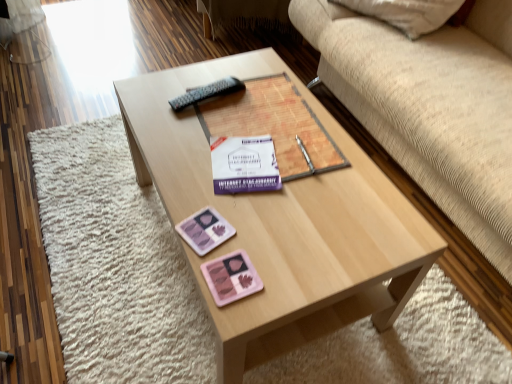
Question: From the image's perspective, would you say pink matte eyeshadow palette at lower center, which is the second currency from top to bottom, is shown under beige fabric couch at upper right?

Choices:
 (A) yes
 (B) no

Answer: (A)

Question: Can you confirm if pink matte eyeshadow palette at lower center, which is the second currency from top to bottom, is positioned to the right of beige fabric couch at upper right?

Choices:
 (A) yes
 (B) no

Answer: (B)

Question: Does pink matte eyeshadow palette at lower center, which is the second currency from top to bottom, have a lesser width compared to beige fabric couch at upper right?

Choices:
 (A) yes
 (B) no

Answer: (A)

Question: Is pink matte eyeshadow palette at lower center, which is the 1th currency from bottom to top, wider than beige fabric couch at upper right?

Choices:
 (A) yes
 (B) no

Answer: (B)

Question: Considering the relative positions of purple matte book at center and white paper at center in the image provided, is purple matte book at center to the left or to the right of white paper at center?

Choices:
 (A) right
 (B) left

Answer: (A)

Question: From the image's perspective, is purple matte book at center located above or below white paper at center?

Choices:
 (A) below
 (B) above

Answer: (B)

Question: Choose the correct answer: Is purple matte book at center inside white paper at center or outside it?

Choices:
 (A) outside
 (B) inside

Answer: (A)

Question: Considering the positions of purple matte book at center and white paper at center in the image, is purple matte book at center bigger or smaller than white paper at center?

Choices:
 (A) small
 (B) big

Answer: (B)

Question: Considering the positions of point (239, 263) and point (337, 135), is point (239, 263) closer or farther from the camera than point (337, 135)?

Choices:
 (A) farther
 (B) closer

Answer: (B)

Question: From the image's perspective, is pink matte eyeshadow palette at lower center, which is the 1th currency from bottom to top, positioned above or below light wood coffee table at center?

Choices:
 (A) above
 (B) below

Answer: (B)

Question: Considering the positions of pink matte eyeshadow palette at lower center, which is the 1th currency from bottom to top, and light wood coffee table at center in the image, is pink matte eyeshadow palette at lower center, which is the 1th currency from bottom to top, taller or shorter than light wood coffee table at center?

Choices:
 (A) tall
 (B) short

Answer: (B)

Question: In the image, is pink matte eyeshadow palette at lower center, which is the second currency from top to bottom, on the left side or the right side of light wood coffee table at center?

Choices:
 (A) left
 (B) right

Answer: (A)

Question: Is point (478, 54) positioned closer to the camera than point (232, 281)?

Choices:
 (A) closer
 (B) farther

Answer: (B)

Question: From the image's perspective, is beige fabric couch at upper right positioned above or below pink matte eyeshadow palette at lower center, which is the 1th currency from bottom to top?

Choices:
 (A) above
 (B) below

Answer: (A)